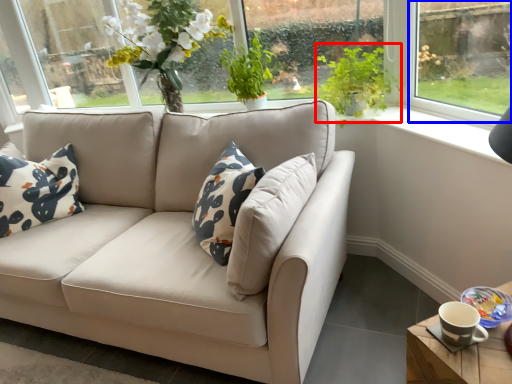
Question: Which of the following is the closest to the observer, plant (highlighted by a red box) or window (highlighted by a blue box)?

Choices:
 (A) plant
 (B) window

Answer: (B)